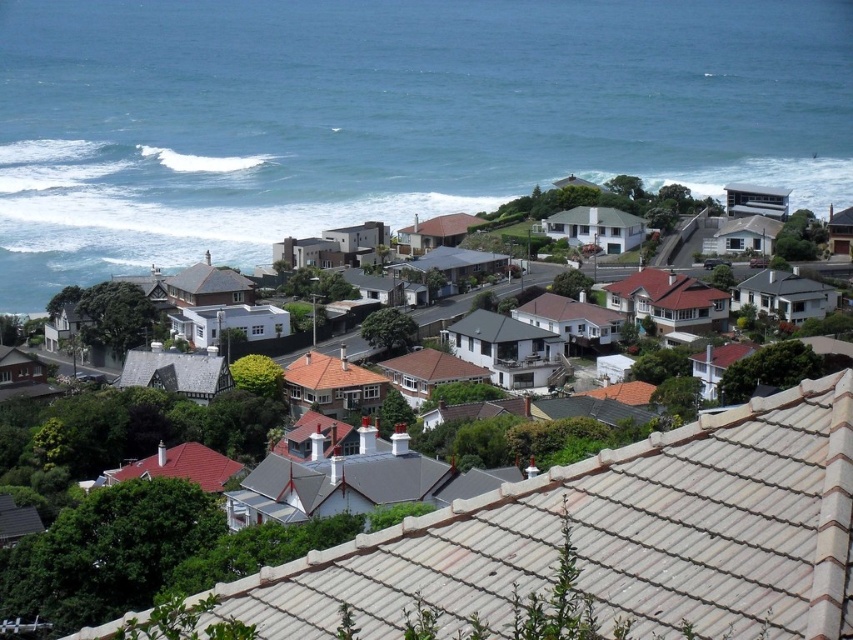
You are standing on a hill overlooking the coastal residential area. You see the blue water at center and the white tile houses at center. Which one is closer to you?

The white tile houses at center are closer to you because the blue water at center is further away.

You are standing on the roof of the building in the foreground and want to locate the blue water at center. Based on your position, in which cardinal direction would you need to look to see it?

The blue water at center is located at point coordinates, but since the scene describes it as being in the center of the image, you would look directly ahead or straight out from the roof to see it.